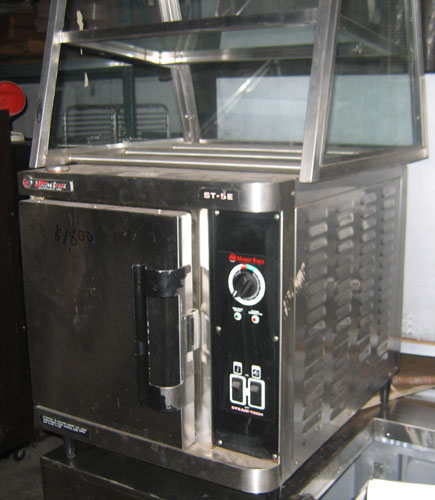
At what (x,y) coordinates should I click in order to perform the action: click on the front right equipment stand or leg. Please return your answer as a coordinate pair (x, y). The width and height of the screenshot is (435, 500). Looking at the image, I should click on (279, 491).